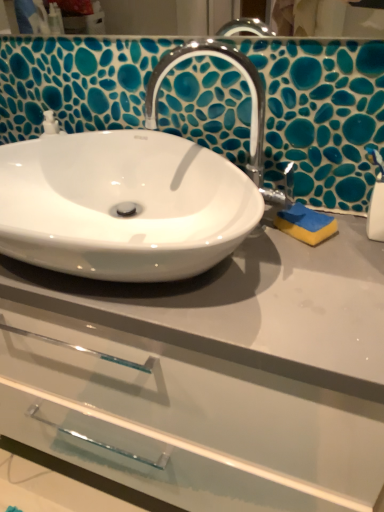
In order to face chrome/polished metal faucet at center, should I rotate leftwards or rightwards?

Rotate your view right by about 1.949°.

What do you see at coordinates (305, 224) in the screenshot?
I see `yellow sponge at right` at bounding box center [305, 224].

Find the location of a particular element. The width and height of the screenshot is (384, 512). chrome/polished metal faucet at center is located at coordinates [251, 109].

From a real-world perspective, is white glossy sink at center beneath white plastic soap dispenser at right?

No, from a real-world perspective, white glossy sink at center is not beneath white plastic soap dispenser at right.

Can you confirm if white glossy sink at center is thinner than white plastic soap dispenser at right?

Incorrect, the width of white glossy sink at center is not less than that of white plastic soap dispenser at right.

From the image's perspective, which one is positioned higher, white glossy sink at center or white plastic soap dispenser at right?

From the image's view, white glossy sink at center is above.

Is point (227, 243) positioned behind point (380, 207)?

No, it is in front of (380, 207).

Is white glossy sink at center wider than yellow sponge at right?

Indeed, white glossy sink at center has a greater width compared to yellow sponge at right.

Is white glossy sink at center oriented away from yellow sponge at right?

No, white glossy sink at center's orientation is not away from yellow sponge at right.

In the image, there is a yellow sponge at right. Where is `sink above it (from the image's perspective)`? The image size is (384, 512). sink above it (from the image's perspective) is located at coordinates (133, 193).

Would you say white glossy sink at center is a long distance from yellow sponge at right?

No.

Is the depth of chrome/polished metal faucet at center greater than that of yellow sponge at right?

That is False.

Based on the photo, is yellow sponge at right completely or partially inside chrome/polished metal faucet at center?

Actually, yellow sponge at right is outside chrome/polished metal faucet at center.

Would you consider chrome/polished metal faucet at center to be distant from yellow sponge at right?

No, chrome/polished metal faucet at center is not far away from yellow sponge at right.

From the image's perspective, is white plastic soap dispenser at right under white glossy drawer at center?

Incorrect, from the image's perspective, white plastic soap dispenser at right is higher than white glossy drawer at center.

From the picture: Is white plastic soap dispenser at right wider or thinner than white glossy drawer at center?

Considering their sizes, white plastic soap dispenser at right looks slimmer than white glossy drawer at center.

Who is bigger, white plastic soap dispenser at right or white glossy drawer at center?

Bigger between the two is white glossy drawer at center.

In the scene shown: Which is closer, [380,176] or [295,400]?

Point [380,176] is farther from the camera than point [295,400].

Considering the positions of point (338, 490) and point (285, 229), is point (338, 490) closer or farther from the camera than point (285, 229)?

Clearly, point (338, 490) is closer to the camera than point (285, 229).

Where is `drawer that appears below the yellow sponge at right (from a real-world perspective)`? drawer that appears below the yellow sponge at right (from a real-world perspective) is located at coordinates (188, 421).

From the picture: Considering the sizes of objects white glossy drawer at center and yellow sponge at right in the image provided, who is wider, white glossy drawer at center or yellow sponge at right?

white glossy drawer at center.

Are white glossy drawer at center and yellow sponge at right located far from each other?

No, there isn't a large distance between white glossy drawer at center and yellow sponge at right.

Is white glossy drawer at center at the right side of white glossy sink at center?

Incorrect, white glossy drawer at center is not on the right side of white glossy sink at center.

Where is `drawer located on the left of white glossy sink at center`? The height and width of the screenshot is (512, 384). drawer located on the left of white glossy sink at center is located at coordinates (188, 421).

Is white glossy drawer at center shorter than white glossy sink at center?

No.

Is white glossy drawer at center spatially inside white glossy sink at center, or outside of it?

white glossy drawer at center is outside white glossy sink at center.

From the image's perspective, does yellow sponge at right appear lower than white glossy sink at center?

Yes, from the image's perspective, yellow sponge at right is beneath white glossy sink at center.

Looking at this image, are yellow sponge at right and white glossy sink at center making contact?

There is a gap between yellow sponge at right and white glossy sink at center.

From a real-world perspective, between yellow sponge at right and white glossy sink at center, who is vertically lower?

yellow sponge at right is physically lower.

Locate an element on the screen. The width and height of the screenshot is (384, 512). sink in front of the white plastic soap dispenser at right is located at coordinates (133, 193).

Locate an element on the screen. soap on the right of the white glossy sink at center is located at coordinates click(305, 224).

Based on their spatial positions, is chrome/polished metal faucet at center or white glossy drawer at center further from white plastic soap dispenser at right?

Among the two, white glossy drawer at center is located further to white plastic soap dispenser at right.

Looking at the image, which one is located further to yellow sponge at right, white glossy drawer at center or chrome/polished metal faucet at center?

Among the two, white glossy drawer at center is located further to yellow sponge at right.

In the scene shown: Estimate the real-world distances between objects in this image. Which object is closer to yellow sponge at right, white glossy sink at center or white plastic soap dispenser at right?

Among the two, white plastic soap dispenser at right is located nearer to yellow sponge at right.

Estimate the real-world distances between objects in this image. Which object is further from white glossy drawer at center, chrome/polished metal faucet at center or yellow sponge at right?

Based on the image, chrome/polished metal faucet at center appears to be further to white glossy drawer at center.

When comparing their distances from white plastic soap dispenser at right, does chrome/polished metal faucet at center or white glossy sink at center seem further?

white glossy sink at center.

Which object lies further to the anchor point chrome/polished metal faucet at center, white glossy drawer at center or white plastic soap dispenser at right?

white glossy drawer at center lies further to chrome/polished metal faucet at center than the other object.

Estimate the real-world distances between objects in this image. Which object is closer to chrome/polished metal faucet at center, white glossy sink at center or white glossy drawer at center?

white glossy sink at center.

When comparing their distances from chrome/polished metal faucet at center, does white plastic soap dispenser at right or white glossy drawer at center seem closer?

The object closer to chrome/polished metal faucet at center is white plastic soap dispenser at right.

Image resolution: width=384 pixels, height=512 pixels. I want to click on tap situated between white glossy sink at center and yellow sponge at right from left to right, so click(251, 109).

At what (x,y) coordinates should I click in order to perform the action: click on soap that lies between chrome/polished metal faucet at center and white glossy drawer at center from top to bottom. Please return your answer as a coordinate pair (x, y). Looking at the image, I should click on (305, 224).

This screenshot has width=384, height=512. I want to click on sink situated between white glossy drawer at center and yellow sponge at right from left to right, so click(x=133, y=193).

The image size is (384, 512). I want to click on sink between white glossy drawer at center and white plastic soap dispenser at right, so click(x=133, y=193).